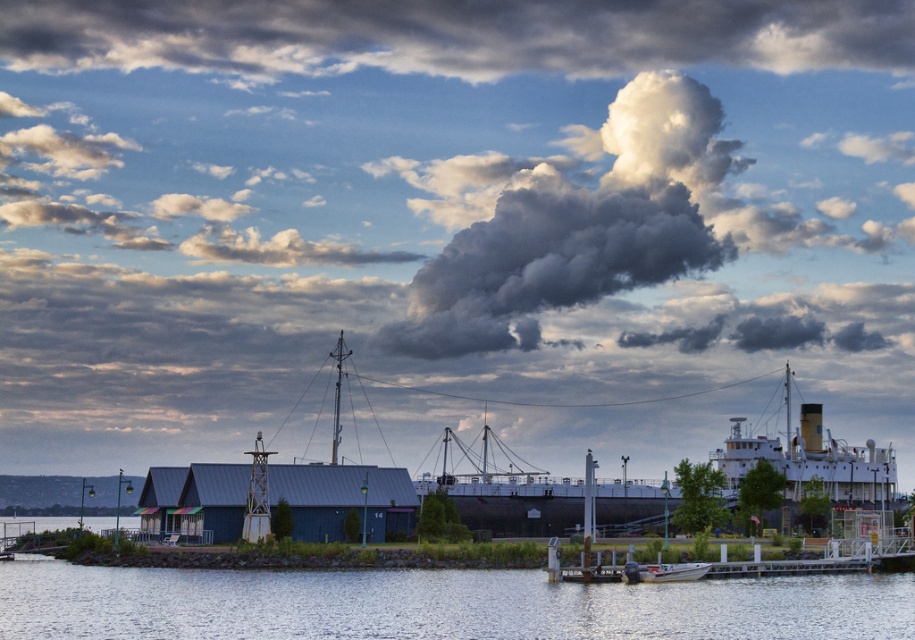
You are an artist trying to paint the waterfront scene. You want to ensure the cloudy cotton candy at upper center and the clear water at lower center are positioned correctly. According to the scene, which object should be placed to the right of the other?

The cloudy cotton candy at upper center should be placed to the right of the clear water at lower center.

You are an artist painting the waterfront scene. You want to ensure that the cloudy cotton candy at upper center and the clear water at lower center are proportionally accurate. Which object should you make taller in your painting?

The cloudy cotton candy at upper center should be made taller than the clear water at lower center because it is taller according to the description.